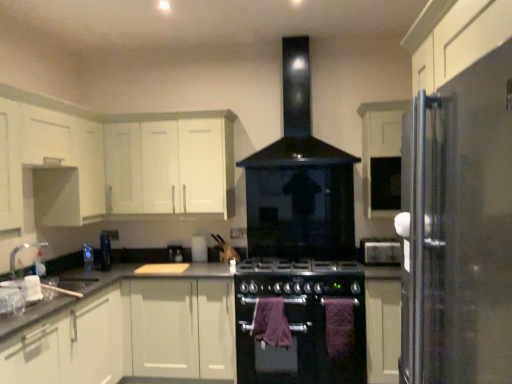
The height and width of the screenshot is (384, 512). What do you see at coordinates (382, 156) in the screenshot?
I see `white matte cabinet at upper right, which is the fifth cabinetry from left to right` at bounding box center [382, 156].

This screenshot has height=384, width=512. Describe the element at coordinates (297, 119) in the screenshot. I see `black glass exhaust hood at center` at that location.

Image resolution: width=512 pixels, height=384 pixels. What do you see at coordinates (70, 345) in the screenshot?
I see `white matte cabinet at lower left, which ranks as the 4th cabinetry in right-to-left order` at bounding box center [70, 345].

Based on the photo, how much space does purple fabric towel at center, the second blanket in the right-to-left sequence, occupy horizontally?

5.71 inches.

Describe the element at coordinates (300, 277) in the screenshot. I see `black matte gas stove at center` at that location.

In order to click on black matte gas stove at center in this screenshot , I will do `click(300, 277)`.

This screenshot has height=384, width=512. What do you see at coordinates (339, 326) in the screenshot? I see `purple cotton towel at lower center, which appears as the 2th blanket when viewed from the left` at bounding box center [339, 326].

Where is `white matte cabinet at upper right, which appears as the 1th cabinetry when viewed from the right`? white matte cabinet at upper right, which appears as the 1th cabinetry when viewed from the right is located at coordinates (382, 156).

Is point (268, 306) closer or farther from the camera than point (342, 344)?

Point (268, 306) appears to be farther away from the viewer than point (342, 344).

Locate an element on the screen. The width and height of the screenshot is (512, 384). blanket that is on the left side of purple cotton towel at lower center, placed as the first blanket when sorted from right to left is located at coordinates (271, 322).

Consider the image. Can you see purple fabric towel at center, the second blanket in the right-to-left sequence, touching purple cotton towel at lower center, placed as the first blanket when sorted from right to left?

No, purple fabric towel at center, the second blanket in the right-to-left sequence, is not with purple cotton towel at lower center, placed as the first blanket when sorted from right to left.

Is white matte cabinet at lower right, which is the 4th cabinetry from left to right, a part of white plastic toaster at center-right, the 2th appliance in the left-to-right sequence?

Definitely not — white matte cabinet at lower right, which is the 4th cabinetry from left to right, is not inside white plastic toaster at center-right, the 2th appliance in the left-to-right sequence.

Does white plastic toaster at center-right, positioned as the first appliance in front-to-back order, have a lesser height compared to white matte cabinet at lower right, the 2th cabinetry positioned from the right?

Yes, white plastic toaster at center-right, positioned as the first appliance in front-to-back order, is shorter than white matte cabinet at lower right, the 2th cabinetry positioned from the right.

How different are the orientations of white plastic toaster at center-right, positioned as the first appliance in front-to-back order, and white matte cabinet at lower right, which is the 4th cabinetry from left to right, in degrees?

white plastic toaster at center-right, positioned as the first appliance in front-to-back order, and white matte cabinet at lower right, which is the 4th cabinetry from left to right, are facing 3.1 degrees away from each other.

Considering the relative sizes of white plastic toaster at center-right, the 2th appliance in the left-to-right sequence, and white matte cabinet at lower right, the 2th cabinetry positioned from the right, in the image provided, is white plastic toaster at center-right, the 2th appliance in the left-to-right sequence, wider than white matte cabinet at lower right, the 2th cabinetry positioned from the right,?

In fact, white plastic toaster at center-right, the 2th appliance in the left-to-right sequence, might be narrower than white matte cabinet at lower right, the 2th cabinetry positioned from the right.

What are the coordinates of `the 2nd appliance above the black matte gas stove at center (from the image's perspective)` in the screenshot? It's located at (380, 251).

Is black matte gas stove at center a part of white plastic toaster at center-right, placed as the first appliance when sorted from right to left?

No, black matte gas stove at center is not inside white plastic toaster at center-right, placed as the first appliance when sorted from right to left.

How far apart are white plastic toaster at center-right, which is the 2th appliance in back-to-front order, and black matte gas stove at center?

They are 47.17 centimeters apart.

From the image's perspective, does white plastic toaster at center-right, which is the 2th appliance in back-to-front order, appear lower than black matte gas stove at center?

Actually, white plastic toaster at center-right, which is the 2th appliance in back-to-front order, appears above black matte gas stove at center in the image.

Is black matte gas stove at center to the right of white matte cabinet at lower right, which is the 4th cabinetry from left to right, from the viewer's perspective?

Incorrect, black matte gas stove at center is not on the right side of white matte cabinet at lower right, which is the 4th cabinetry from left to right.

What's the angular difference between black matte gas stove at center and white matte cabinet at lower right, the 2th cabinetry positioned from the right,'s facing directions?

black matte gas stove at center and white matte cabinet at lower right, the 2th cabinetry positioned from the right, are facing 0.617 degrees away from each other.

Looking at this image, is white matte cabinet at lower right, which is the 4th cabinetry from left to right, located within black matte gas stove at center?

No, white matte cabinet at lower right, which is the 4th cabinetry from left to right, is not a part of black matte gas stove at center.

In the scene shown: Is matte white cabinet at left, placed as the first cabinetry when sorted from left to right, bigger or smaller than purple fabric towel at center, the second blanket in the right-to-left sequence?

matte white cabinet at left, placed as the first cabinetry when sorted from left to right, is bigger than purple fabric towel at center, the second blanket in the right-to-left sequence.

Considering the sizes of objects matte white cabinet at left, the 5th cabinetry from the right, and purple fabric towel at center, marked as the first blanket in a left-to-right arrangement, in the image provided, who is taller, matte white cabinet at left, the 5th cabinetry from the right, or purple fabric towel at center, marked as the first blanket in a left-to-right arrangement,?

matte white cabinet at left, the 5th cabinetry from the right.

Which object is closer to the camera, matte white cabinet at left, the 5th cabinetry from the right, or purple fabric towel at center, the second blanket in the right-to-left sequence?

matte white cabinet at left, the 5th cabinetry from the right, is in front.

In the image, is white matte cabinet at lower left, which ranks as the 4th cabinetry in right-to-left order, positioned in front of or behind black matte gas stove at center?

Visually, white matte cabinet at lower left, which ranks as the 4th cabinetry in right-to-left order, is located in front of black matte gas stove at center.

Considering the sizes of objects white matte cabinet at lower left, which ranks as the 4th cabinetry in right-to-left order, and black matte gas stove at center in the image provided, who is wider, white matte cabinet at lower left, which ranks as the 4th cabinetry in right-to-left order, or black matte gas stove at center?

white matte cabinet at lower left, which ranks as the 4th cabinetry in right-to-left order.

Is white matte cabinet at lower left, which ranks as the 4th cabinetry in right-to-left order, positioned far away from black matte gas stove at center?

Yes, white matte cabinet at lower left, which ranks as the 4th cabinetry in right-to-left order, and black matte gas stove at center are located far from each other.

Does black glass exhaust hood at center have a lesser width compared to purple cotton towel at lower center, which appears as the 2th blanket when viewed from the left?

No, black glass exhaust hood at center is not thinner than purple cotton towel at lower center, which appears as the 2th blanket when viewed from the left.

From a real-world perspective, which object stands above the other?

In real-world perspective, black glass exhaust hood at center is above.

Can you see black glass exhaust hood at center touching purple cotton towel at lower center, placed as the first blanket when sorted from right to left?

No, black glass exhaust hood at center is not beside purple cotton towel at lower center, placed as the first blanket when sorted from right to left.

Which object is positioned more to the right, black glass exhaust hood at center or purple cotton towel at lower center, which appears as the 2th blanket when viewed from the left?

Positioned to the right is purple cotton towel at lower center, which appears as the 2th blanket when viewed from the left.

In the image, there is a purple fabric towel at center, the second blanket in the right-to-left sequence. Where is `blanket below it (from the image's perspective)`? blanket below it (from the image's perspective) is located at coordinates coord(339,326).

Image resolution: width=512 pixels, height=384 pixels. In order to click on the 2nd cabinetry in front of the white plastic toaster at center-right, positioned as the first appliance in front-to-back order, starting your count from the anchor in this screenshot , I will do `click(383, 329)`.

Looking at this image, estimate the real-world distances between objects in this image. Which object is closer to white matte cabinet at upper right, which is the fifth cabinetry from left to right, black matte oven at center or white plastic toaster at center-right, placed as the first appliance when sorted from right to left?

The object closer to white matte cabinet at upper right, which is the fifth cabinetry from left to right, is white plastic toaster at center-right, placed as the first appliance when sorted from right to left.

Based on the photo, based on their spatial positions, is white matte cabinet at lower right, the 2th cabinetry positioned from the right, or satin black kettle at center, positioned as the second appliance in front-to-back order, closer to white matte cabinet at upper left, the 3th cabinetry from the left?

satin black kettle at center, positioned as the second appliance in front-to-back order, lies closer to white matte cabinet at upper left, the 3th cabinetry from the left, than the other object.

Estimate the real-world distances between objects in this image. Which object is further from white matte cabinet at lower left, arranged as the 2th cabinetry when viewed from the left, white plastic toaster at center-right, positioned as the first appliance in front-to-back order, or black matte gas stove at center?

white plastic toaster at center-right, positioned as the first appliance in front-to-back order, lies further to white matte cabinet at lower left, arranged as the 2th cabinetry when viewed from the left, than the other object.

Considering their positions, is granite gray countertop at center positioned further to black glass exhaust hood at center than white matte cabinet at lower left, arranged as the 2th cabinetry when viewed from the left?

The object further to black glass exhaust hood at center is white matte cabinet at lower left, arranged as the 2th cabinetry when viewed from the left.

In the scene shown: Based on their spatial positions, is white matte cabinet at lower right, which is the 4th cabinetry from left to right, or purple cotton towel at lower center, placed as the first blanket when sorted from right to left, further from white matte cabinet at upper right, which is the fifth cabinetry from left to right?

purple cotton towel at lower center, placed as the first blanket when sorted from right to left, is positioned further to the anchor white matte cabinet at upper right, which is the fifth cabinetry from left to right.

Considering their positions, is white matte cabinet at lower right, the 2th cabinetry positioned from the right, positioned further to granite gray countertop at center than white plastic toaster at center-right, which is the 2th appliance in back-to-front order?

Among the two, white plastic toaster at center-right, which is the 2th appliance in back-to-front order, is located further to granite gray countertop at center.

Looking at the image, which one is located closer to granite gray countertop at center, black glass exhaust hood at center or purple cotton towel at lower center, which appears as the 2th blanket when viewed from the left?

Among the two, purple cotton towel at lower center, which appears as the 2th blanket when viewed from the left, is located nearer to granite gray countertop at center.

When comparing their distances from purple fabric towel at center, marked as the first blanket in a left-to-right arrangement, does black matte oven at center or black matte gas stove at center seem further?

black matte gas stove at center.

At what (x,y) coordinates should I click in order to perform the action: click on gas stove located between satin black kettle at center, the first appliance from the left, and white matte cabinet at lower right, which is the 4th cabinetry from left to right, in the left-right direction. Please return your answer as a coordinate pair (x, y). This screenshot has width=512, height=384. Looking at the image, I should click on (300, 277).

You are a GUI agent. You are given a task and a screenshot of the screen. Output one action in this format:
    pyautogui.click(x=<x>, y=<y>)
    Task: Click on the oven situated between white matte cabinet at lower left, arranged as the 2th cabinetry when viewed from the left, and white plastic toaster at center-right, which is the 2th appliance in back-to-front order, from left to right
    The image size is (512, 384).
    Given the screenshot: What is the action you would take?
    pyautogui.click(x=300, y=329)

This screenshot has height=384, width=512. I want to click on cabinetry located between satin black kettle at center, positioned as the second appliance in front-to-back order, and white matte cabinet at lower right, the 2th cabinetry positioned from the right, in the left-right direction, so click(170, 167).

Where is `countertop between matte white cabinet at left, placed as the first cabinetry when sorted from left to right, and purple fabric towel at center, the second blanket in the right-to-left sequence, in the horizontal direction`? The height and width of the screenshot is (384, 512). countertop between matte white cabinet at left, placed as the first cabinetry when sorted from left to right, and purple fabric towel at center, the second blanket in the right-to-left sequence, in the horizontal direction is located at coordinates (137, 276).